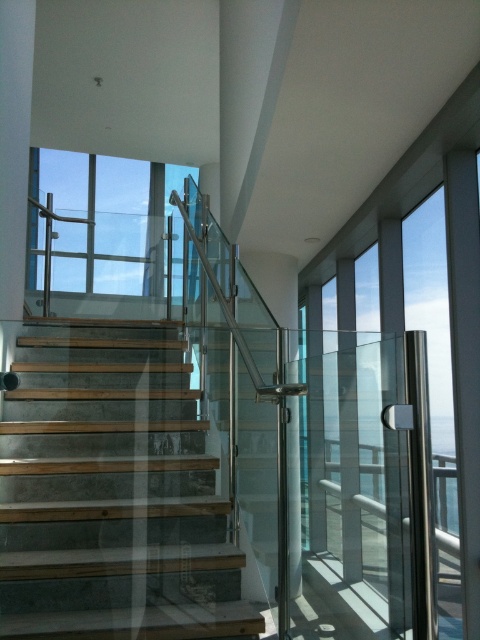
Describe the element at coordinates (111, 492) in the screenshot. I see `wooden steps at center` at that location.

Is point (48, 456) positioned in front of point (69, 256)?

Yes.

Locate an element on the screen. wooden steps at center is located at coordinates (111, 492).